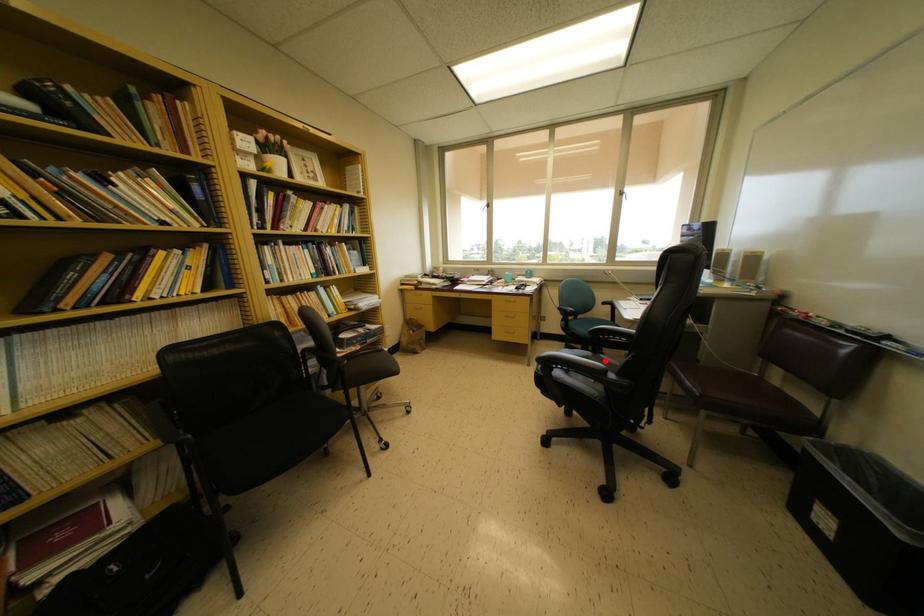
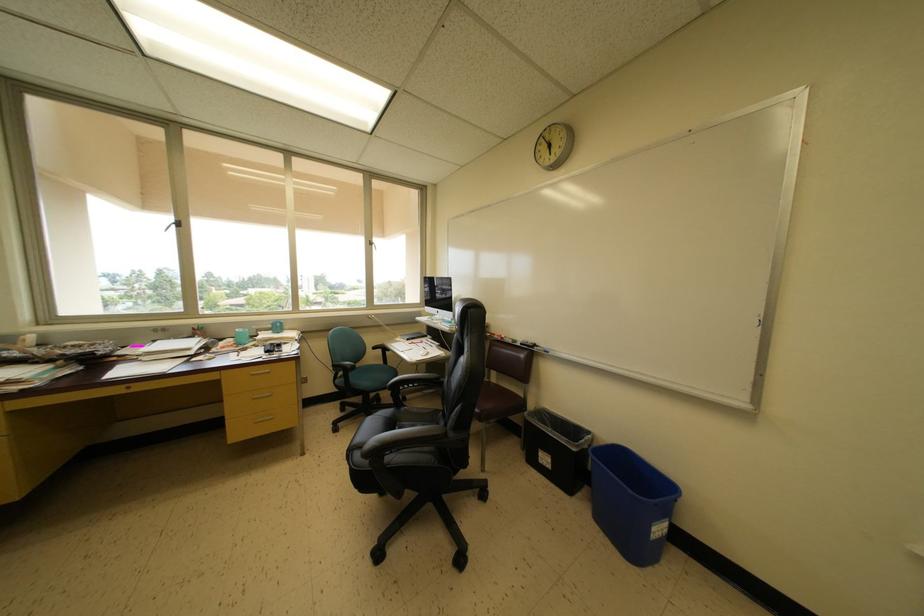
The point at the highlighted location is marked in the first image. Where is the corresponding point in the second image?

(408, 413)